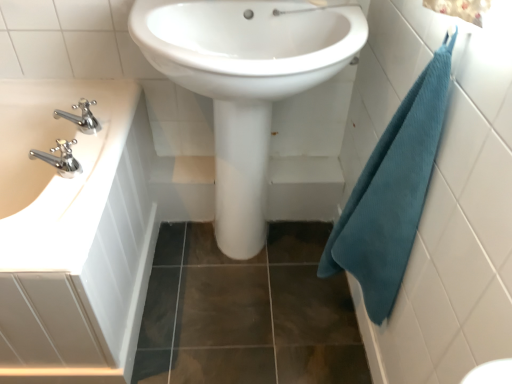
At what (x,y) coordinates should I click in order to perform the action: click on free space to the back side of chrome metallic faucet at left. Please return your answer as a coordinate pair (x, y). Looking at the image, I should click on (92, 94).